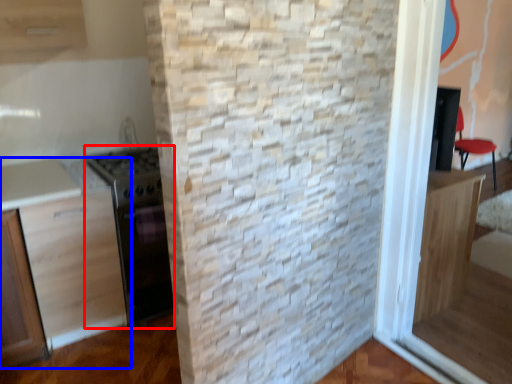
Question: Which object appears closest to the camera in this image, appliance (highlighted by a red box) or cabinetry (highlighted by a blue box)?

Choices:
 (A) appliance
 (B) cabinetry

Answer: (B)